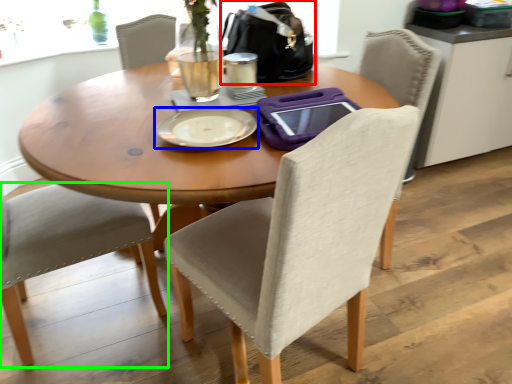
Question: Based on their relative distances, which object is nearer to handbag (highlighted by a red box)? Choose from plate (highlighted by a blue box) and chair (highlighted by a green box).

Choices:
 (A) plate
 (B) chair

Answer: (A)